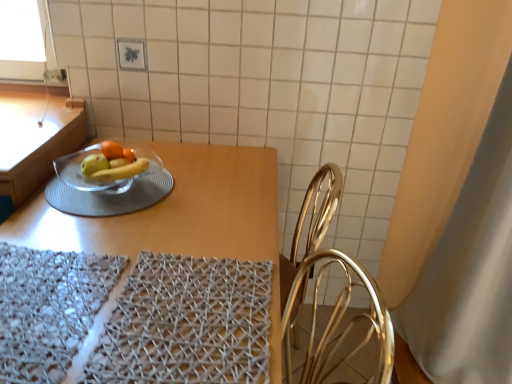
Question: Considering the relative sizes of transparent glass bowl at center and white fabric curtain at right in the image provided, is transparent glass bowl at center shorter than white fabric curtain at right?

Choices:
 (A) yes
 (B) no

Answer: (A)

Question: Is transparent glass bowl at center far away from white fabric curtain at right?

Choices:
 (A) yes
 (B) no

Answer: (A)

Question: Is transparent glass bowl at center next to white fabric curtain at right?

Choices:
 (A) yes
 (B) no

Answer: (B)

Question: Does transparent glass bowl at center come in front of white fabric curtain at right?

Choices:
 (A) yes
 (B) no

Answer: (B)

Question: Considering the relative sizes of transparent glass bowl at center and white fabric curtain at right in the image provided, is transparent glass bowl at center smaller than white fabric curtain at right?

Choices:
 (A) no
 (B) yes

Answer: (B)

Question: From the image's perspective, relative to white fabric curtain at right, is woven fabric place mat at lower left, which is the first place mat from left to right, above or below?

Choices:
 (A) above
 (B) below

Answer: (B)

Question: Is woven fabric place mat at lower left, which is the second place mat in right-to-left order, wider or thinner than white fabric curtain at right?

Choices:
 (A) thin
 (B) wide

Answer: (A)

Question: Do you think woven fabric place mat at lower left, which is the first place mat from left to right, is within white fabric curtain at right, or outside of it?

Choices:
 (A) outside
 (B) inside

Answer: (A)

Question: Is woven fabric place mat at lower left, which is the second place mat in right-to-left order, in front of or behind white fabric curtain at right in the image?

Choices:
 (A) behind
 (B) front

Answer: (B)

Question: Is woven fabric place mat at lower left, which is the second place mat in right-to-left order, bigger or smaller than transparent glass bowl at center?

Choices:
 (A) small
 (B) big

Answer: (B)

Question: In terms of height, does woven fabric place mat at lower left, which is the first place mat from left to right, look taller or shorter compared to transparent glass bowl at center?

Choices:
 (A) short
 (B) tall

Answer: (B)

Question: Do you think woven fabric place mat at lower left, which is the second place mat in right-to-left order, is within transparent glass bowl at center, or outside of it?

Choices:
 (A) outside
 (B) inside

Answer: (A)

Question: From a real-world perspective, is woven fabric place mat at lower left, which is the first place mat from left to right, positioned above or below transparent glass bowl at center?

Choices:
 (A) above
 (B) below

Answer: (A)

Question: From the image's perspective, is transparent glass bowl at center above or below woven fabric place mat at lower left, which is the second place mat in right-to-left order?

Choices:
 (A) below
 (B) above

Answer: (B)

Question: Visually, is transparent glass bowl at center positioned to the left or to the right of woven fabric place mat at lower left, which is the second place mat in right-to-left order?

Choices:
 (A) right
 (B) left

Answer: (A)